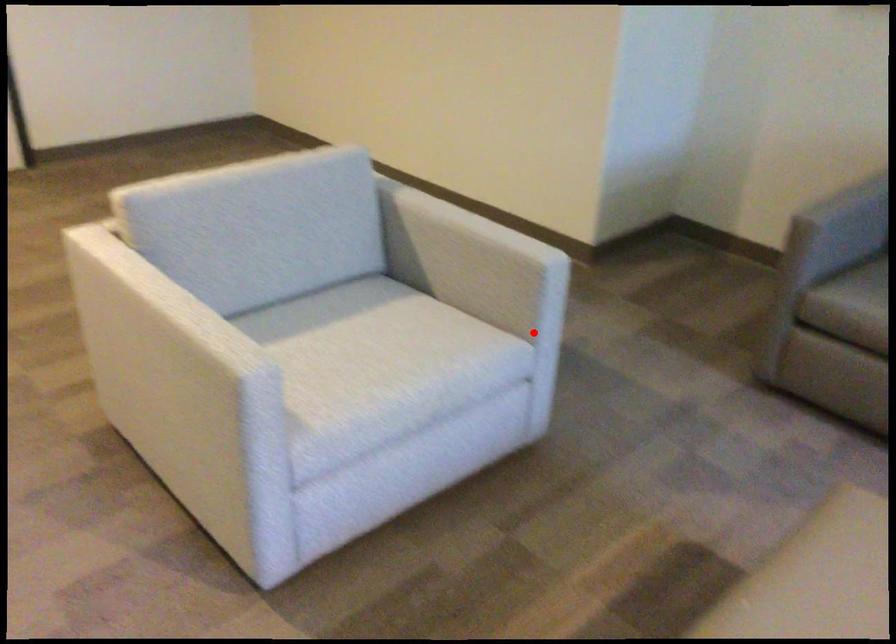
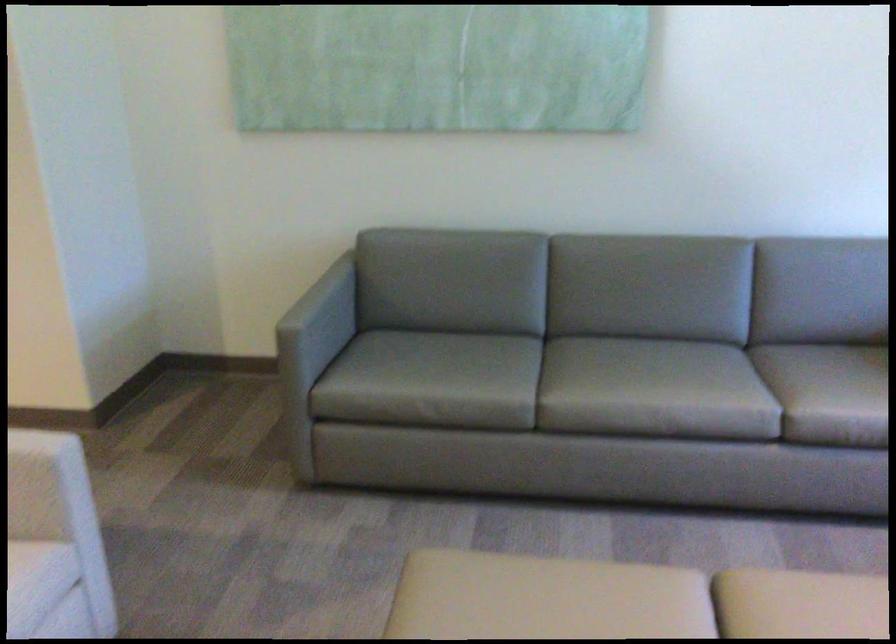
Where in the second image is the point corresponding to the highlighted location from the first image?

(55, 542)